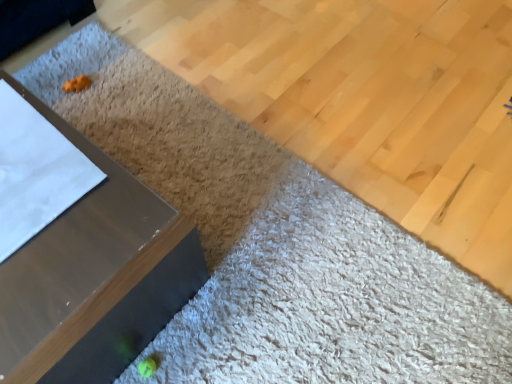
Question: In the image, is matte wood plywood at lower left on the left side or the right side of metallic gray table at left?

Choices:
 (A) left
 (B) right

Answer: (B)

Question: Would you say matte wood plywood at lower left is inside or outside metallic gray table at left?

Choices:
 (A) inside
 (B) outside

Answer: (B)

Question: From a real-world perspective, is matte wood plywood at lower left physically located above or below metallic gray table at left?

Choices:
 (A) below
 (B) above

Answer: (A)

Question: From a real-world perspective, relative to matte wood plywood at lower left, is metallic gray table at left vertically above or below?

Choices:
 (A) above
 (B) below

Answer: (A)

Question: Is metallic gray table at left spatially inside matte wood plywood at lower left, or outside of it?

Choices:
 (A) inside
 (B) outside

Answer: (B)

Question: From the image's perspective, is metallic gray table at left located above or below matte wood plywood at lower left?

Choices:
 (A) below
 (B) above

Answer: (A)

Question: Does point (96, 359) appear closer or farther from the camera than point (223, 21)?

Choices:
 (A) closer
 (B) farther

Answer: (A)